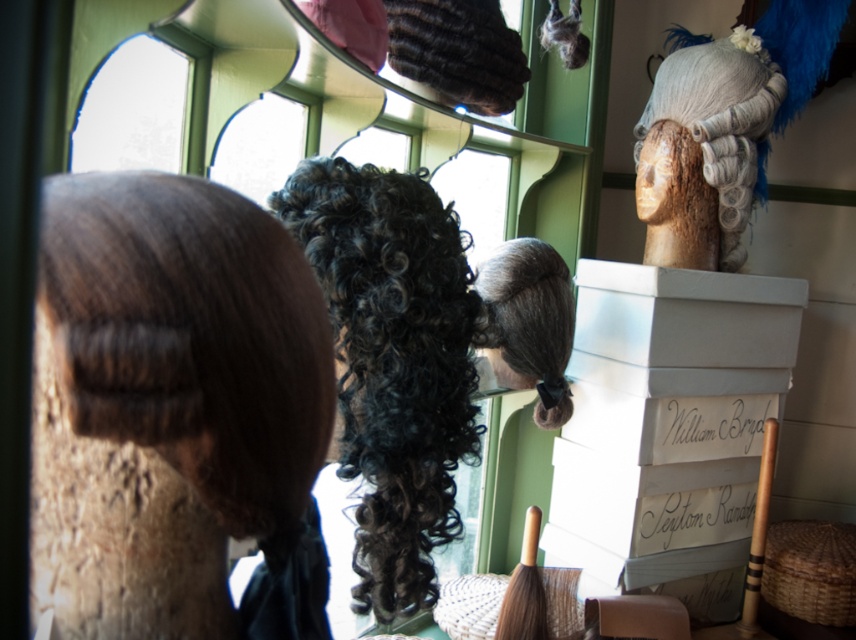
Can you confirm if dark brown hair at center is positioned below white fabric wig at upper right?

Correct, dark brown hair at center is located below white fabric wig at upper right.

How much distance is there between dark brown hair at center and white fabric wig at upper right?

dark brown hair at center and white fabric wig at upper right are 1.59 meters apart.

Is point (257, 406) closer to viewer compared to point (679, 148)?

Yes, point (257, 406) is in front of point (679, 148).

Identify the location of dark brown hair at center. The height and width of the screenshot is (640, 856). (165, 400).

Does white fabric wig at upper right have a lesser height compared to dark brown curly wig at center?

In fact, white fabric wig at upper right may be taller than dark brown curly wig at center.

From the picture: Which is below, white fabric wig at upper right or dark brown curly wig at center?

Positioned lower is dark brown curly wig at center.

Is point (710, 253) positioned in front of point (507, 332)?

No, (710, 253) is further to viewer.

Find the location of a particular element. The image size is (856, 640). white fabric wig at upper right is located at coordinates (703, 148).

Measure the distance between point (214, 493) and camera.

They are 21.36 inches apart.

In the scene shown: Between dark brown hair at center and dark brown curly wig at center, which one appears on the right side from the viewer's perspective?

Positioned to the right is dark brown curly wig at center.

Which is behind, point (149, 310) or point (542, 372)?

Point (542, 372)

At what (x,y) coordinates should I click in order to perform the action: click on dark brown hair at center. Please return your answer as a coordinate pair (x, y). The height and width of the screenshot is (640, 856). Looking at the image, I should click on (165, 400).